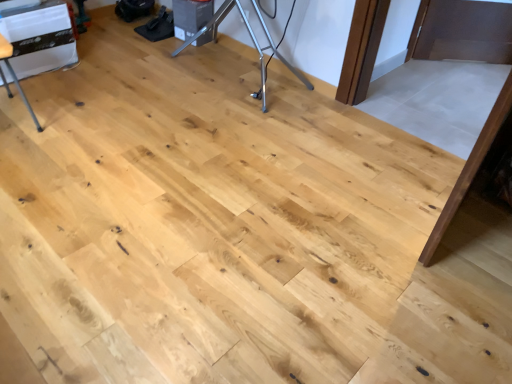
Find the location of a particular element. vacant space situated on the left part of silver metallic tripod at center is located at coordinates (129, 54).